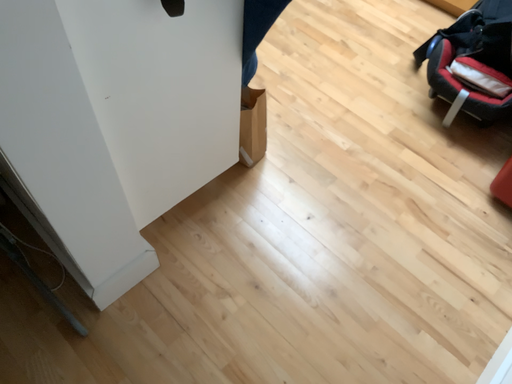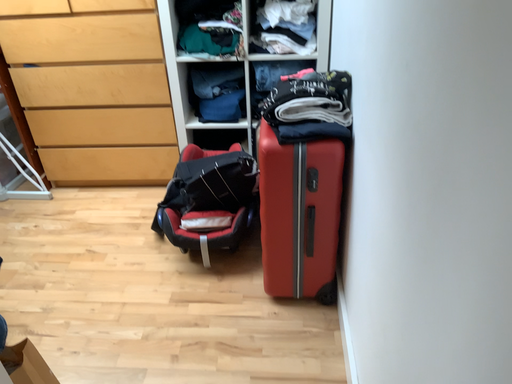
Question: How did the camera likely rotate when shooting the video?

Choices:
 (A) rotated downward
 (B) rotated upward

Answer: (B)